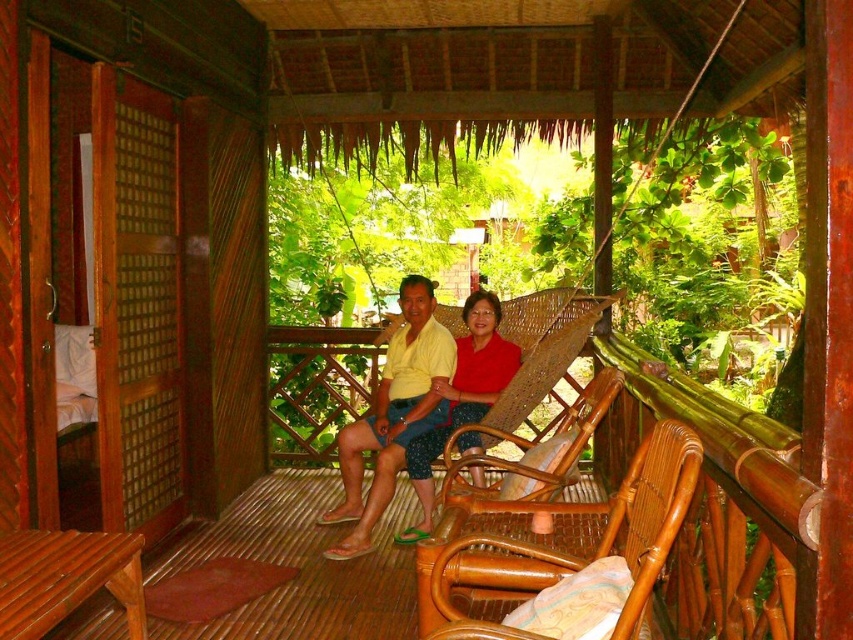
Based on the photo, you are standing on the porch and want to sit down next to the person wearing the yellow matte shirt at center. Which direction should you move relative to the rattan chair at center?

The rattan chair at center is positioned on the right side of yellow matte shirt at center. To sit next to the yellow matte shirt at center, you should move to the left side of the rattan chair at center.

You are a delivery person carrying a package that requires a 1.5 meter clearance to maneuver safely. You need to pass between the rattan chair at center and the matte red blouse at center. Can you safely navigate through this space with the package?

The distance between the rattan chair at center and the matte red blouse at center is 1.47 meters, which is slightly less than the required 1.5 meters clearance. Therefore, it might be risky to navigate through this space with the package as there is insufficient clearance.